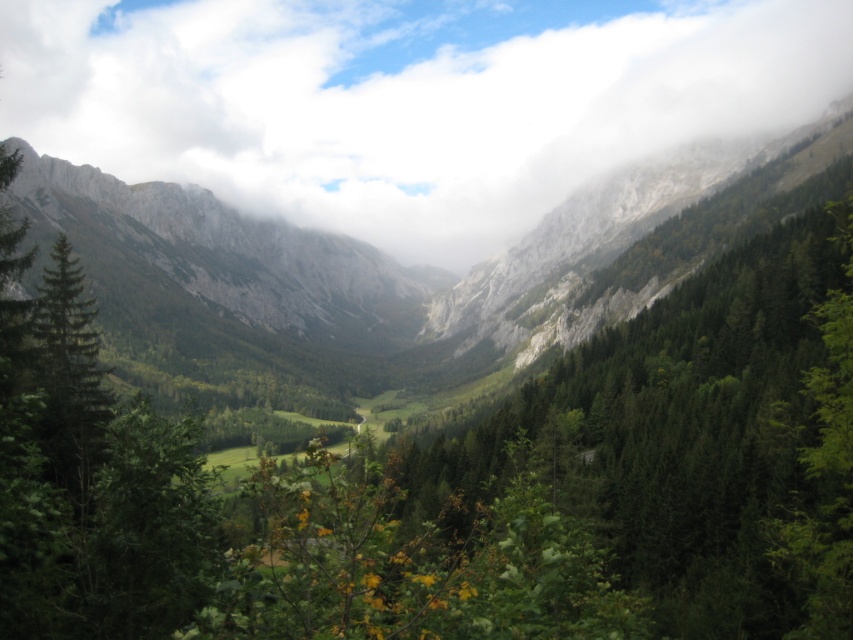
Does white fluffy cloud at center have a greater width compared to rugged stone mountain at left?

Yes, white fluffy cloud at center is wider than rugged stone mountain at left.

Looking at this image, measure the distance from white fluffy cloud at center to rugged stone mountain at left.

They are 458.37 feet apart.

Between point (753, 128) and point (202, 244), which one is positioned in front?

Point (753, 128) is in front.

You are a GUI agent. You are given a task and a screenshot of the screen. Output one action in this format:
    pyautogui.click(x=<x>, y=<y>)
    Task: Click on the white fluffy cloud at center
    The width and height of the screenshot is (853, 640).
    Given the screenshot: What is the action you would take?
    pyautogui.click(x=405, y=100)

Can you confirm if white fluffy cloud at center is taller than green matte forest at center?

Yes.

Describe the element at coordinates (405, 100) in the screenshot. I see `white fluffy cloud at center` at that location.

The height and width of the screenshot is (640, 853). I want to click on white fluffy cloud at center, so click(x=405, y=100).

Is green matte forest at center taller than rugged stone mountain at left?

Incorrect, green matte forest at center's height is not larger of rugged stone mountain at left's.

Between green matte forest at center and rugged stone mountain at left, which one appears on the left side from the viewer's perspective?

Positioned to the left is rugged stone mountain at left.

Looking at this image, who is more forward, (714,454) or (190,220)?

Point (714,454)

At what (x,y) coordinates should I click in order to perform the action: click on green matte forest at center. Please return your answer as a coordinate pair (x, y). The height and width of the screenshot is (640, 853). Looking at the image, I should click on (695, 442).